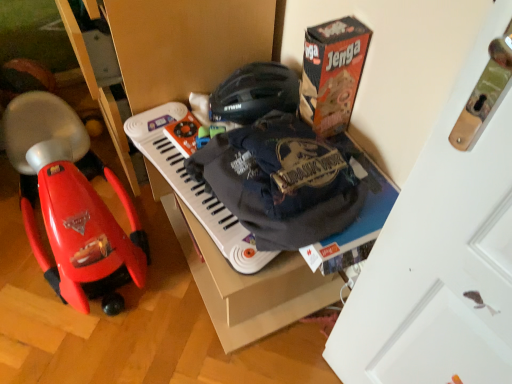
What are the coordinates of `white plastic musical keyboard at center` in the screenshot? It's located at (194, 186).

Measure the distance between shiny red plastic baby carriage at left and camera.

shiny red plastic baby carriage at left and camera are 1.15 meters apart.

What do you see at coordinates (441, 258) in the screenshot?
I see `white matte door at upper right` at bounding box center [441, 258].

Find the location of a particular element. white plastic musical keyboard at center is located at coordinates (194, 186).

Is white matte door at upper right taller or shorter than shiny red plastic baby carriage at left?

In the image, white matte door at upper right appears to be taller than shiny red plastic baby carriage at left.

Looking at this image, looking at the image, does white matte door at upper right seem bigger or smaller compared to shiny red plastic baby carriage at left?

Clearly, white matte door at upper right is smaller in size than shiny red plastic baby carriage at left.

Are white matte door at upper right and shiny red plastic baby carriage at left beside each other?

No, white matte door at upper right is not beside shiny red plastic baby carriage at left.

Is white matte door at upper right located outside shiny red plastic baby carriage at left?

That's correct, white matte door at upper right is outside of shiny red plastic baby carriage at left.

Is point (342, 66) in front of point (406, 320)?

No.

Considering the sizes of orange cardboard jenga box at upper right and white matte door at upper right in the image, is orange cardboard jenga box at upper right taller or shorter than white matte door at upper right?

orange cardboard jenga box at upper right is shorter than white matte door at upper right.

Considering the sizes of objects orange cardboard jenga box at upper right and white matte door at upper right in the image provided, who is bigger, orange cardboard jenga box at upper right or white matte door at upper right?

white matte door at upper right.

Considering the relative positions of white plastic musical keyboard at center and white matte door at upper right in the image provided, is white plastic musical keyboard at center in front of white matte door at upper right?

No, it is behind white matte door at upper right.

From a real-world perspective, is white plastic musical keyboard at center under white matte door at upper right?

Yes, from a real-world perspective, white plastic musical keyboard at center is beneath white matte door at upper right.

What's the angular difference between white plastic musical keyboard at center and white matte door at upper right's facing directions?

There is a 0.565-degree angle between the facing directions of white plastic musical keyboard at center and white matte door at upper right.

Looking at this image, from a real-world perspective, relative to orange cardboard jenga box at upper right, is shiny red plastic baby carriage at left vertically above or below?

shiny red plastic baby carriage at left is situated lower than orange cardboard jenga box at upper right in the real world.

Considering the positions of objects shiny red plastic baby carriage at left and orange cardboard jenga box at upper right in the image provided, who is behind, shiny red plastic baby carriage at left or orange cardboard jenga box at upper right?

Positioned behind is shiny red plastic baby carriage at left.

I want to click on baby carriage behind the orange cardboard jenga box at upper right, so click(71, 204).

Does point (58, 133) come behind point (328, 355)?

Yes, point (58, 133) is behind point (328, 355).

Can you confirm if shiny red plastic baby carriage at left is smaller than white matte door at upper right?

Incorrect, shiny red plastic baby carriage at left is not smaller in size than white matte door at upper right.

Would you say shiny red plastic baby carriage at left is inside or outside white matte door at upper right?

shiny red plastic baby carriage at left is outside white matte door at upper right.

Does shiny red plastic baby carriage at left lie in front of white matte door at upper right?

No, shiny red plastic baby carriage at left is behind white matte door at upper right.

Is white plastic musical keyboard at center directly adjacent to shiny red plastic baby carriage at left?

white plastic musical keyboard at center and shiny red plastic baby carriage at left are not in contact.

Considering the relative sizes of white plastic musical keyboard at center and shiny red plastic baby carriage at left in the image provided, is white plastic musical keyboard at center shorter than shiny red plastic baby carriage at left?

Yes, white plastic musical keyboard at center is shorter than shiny red plastic baby carriage at left.

Which is behind, point (168, 170) or point (20, 158)?

Positioned behind is point (20, 158).

Which point is more forward, [438,161] or [330,101]?

The point [438,161] is more forward.

Looking at this image, is white matte door at upper right looking in the opposite direction of orange cardboard jenga box at upper right?

No, white matte door at upper right is not facing the opposite direction of orange cardboard jenga box at upper right.

Relative to orange cardboard jenga box at upper right, is white matte door at upper right in front or behind?

Clearly, white matte door at upper right is in front of orange cardboard jenga box at upper right.

I want to click on baby carriage beneath the white matte door at upper right (from a real-world perspective), so click(x=71, y=204).

Image resolution: width=512 pixels, height=384 pixels. Identify the location of door on the right of orange cardboard jenga box at upper right. (441, 258).

From the image, which object appears to be farther from white plastic musical keyboard at center, white matte door at upper right or orange cardboard jenga box at upper right?

white matte door at upper right.

Estimate the real-world distances between objects in this image. Which object is further from white matte door at upper right, white plastic musical keyboard at center or orange cardboard jenga box at upper right?

orange cardboard jenga box at upper right is further to white matte door at upper right.

Based on their spatial positions, is white matte door at upper right or white plastic musical keyboard at center further from shiny red plastic baby carriage at left?

white matte door at upper right is further to shiny red plastic baby carriage at left.

Estimate the real-world distances between objects in this image. Which object is closer to white plastic musical keyboard at center, white matte door at upper right or shiny red plastic baby carriage at left?

Among the two, shiny red plastic baby carriage at left is located nearer to white plastic musical keyboard at center.

Which object lies nearer to the anchor point orange cardboard jenga box at upper right, shiny red plastic baby carriage at left or white matte door at upper right?

The object closer to orange cardboard jenga box at upper right is white matte door at upper right.

From the picture: Which object lies further to the anchor point white matte door at upper right, shiny red plastic baby carriage at left or white plastic musical keyboard at center?

Based on the image, shiny red plastic baby carriage at left appears to be further to white matte door at upper right.

Which object lies nearer to the anchor point shiny red plastic baby carriage at left, orange cardboard jenga box at upper right or white plastic musical keyboard at center?

Based on the image, white plastic musical keyboard at center appears to be nearer to shiny red plastic baby carriage at left.

Estimate the real-world distances between objects in this image. Which object is further from shiny red plastic baby carriage at left, white plastic musical keyboard at center or white matte door at upper right?

white matte door at upper right lies further to shiny red plastic baby carriage at left than the other object.

You are a GUI agent. You are given a task and a screenshot of the screen. Output one action in this format:
    pyautogui.click(x=<x>, y=<y>)
    Task: Click on the musical keyboard located between shiny red plastic baby carriage at left and white matte door at upper right in the left-right direction
    The height and width of the screenshot is (384, 512).
    Given the screenshot: What is the action you would take?
    pyautogui.click(x=194, y=186)

At what (x,y) coordinates should I click in order to perform the action: click on musical keyboard located between shiny red plastic baby carriage at left and orange cardboard jenga box at upper right in the left-right direction. Please return your answer as a coordinate pair (x, y). Image resolution: width=512 pixels, height=384 pixels. Looking at the image, I should click on (194, 186).

What are the coordinates of `box between white matte door at upper right and white plastic musical keyboard at center along the z-axis` in the screenshot? It's located at (332, 73).

The width and height of the screenshot is (512, 384). Identify the location of box located between shiny red plastic baby carriage at left and white matte door at upper right in the left-right direction. (332, 73).